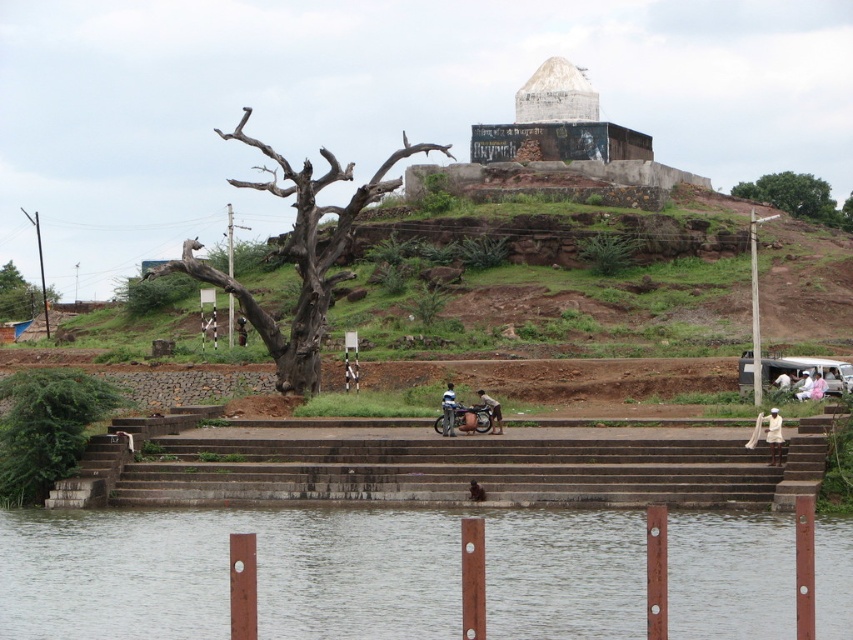
Who is positioned more to the left, brown rough tree at upper center or dark blue jeans at center?

From the viewer's perspective, brown rough tree at upper center appears more on the left side.

Is brown rough tree at upper center below dark blue jeans at center?

No, brown rough tree at upper center is not below dark blue jeans at center.

Where is `brown rough tree at upper center`? brown rough tree at upper center is located at coordinates (601, 276).

You are a GUI agent. You are given a task and a screenshot of the screen. Output one action in this format:
    pyautogui.click(x=<x>, y=<y>)
    Task: Click on the brown rough tree at upper center
    This screenshot has width=853, height=640.
    Given the screenshot: What is the action you would take?
    pyautogui.click(x=601, y=276)

Does point (170, 451) lie in front of point (756, 198)?

Yes, point (170, 451) is closer to viewer.

Which is more to the left, brown stone stairs at center or green leafy tree at upper right?

Positioned to the left is brown stone stairs at center.

Does point (286, 499) lie behind point (838, 212)?

No.

The image size is (853, 640). I want to click on brown stone stairs at center, so click(x=448, y=472).

Does green leafy tree at lower left appear on the left side of brown rough tree at left?

No, green leafy tree at lower left is not to the left of brown rough tree at left.

Measure the distance between point (7, 493) and camera.

Point (7, 493) and camera are 80.98 meters apart.

Where is `green leafy tree at lower left`? The image size is (853, 640). green leafy tree at lower left is located at coordinates (45, 428).

Where is `green leafy tree at lower left`? green leafy tree at lower left is located at coordinates (45, 428).